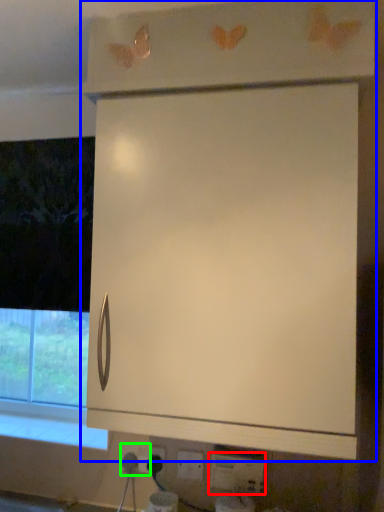
Question: Considering the real-world distances, which object is farthest from electric outlet (highlighted by a red box)? cabinetry (highlighted by a blue box) or electric outlet (highlighted by a green box)?

Choices:
 (A) cabinetry
 (B) electric outlet

Answer: (A)